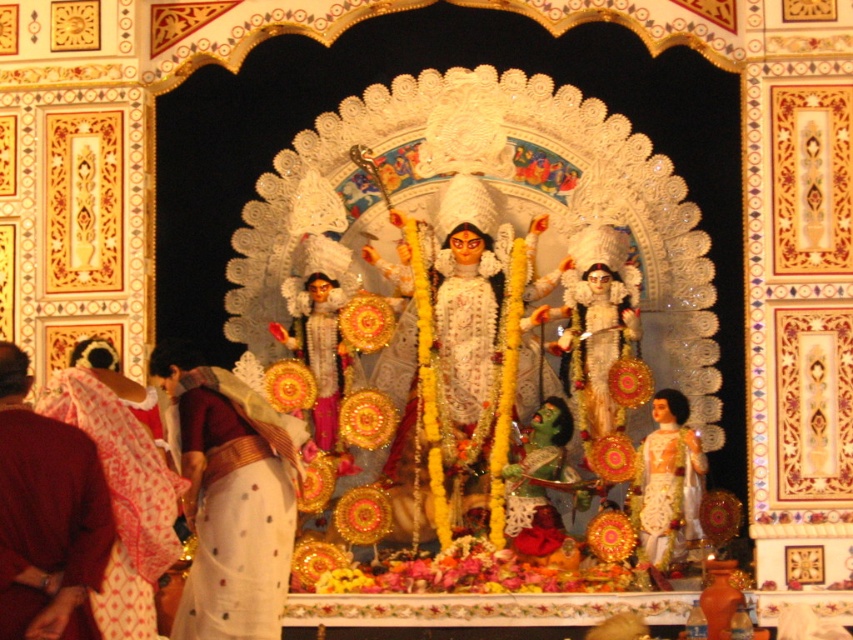
Consider the image. Which of these two, white silk saree at center or maroon silk robe at lower left, stands shorter?

Standing shorter between the two is maroon silk robe at lower left.

Who is higher up, white silk saree at center or maroon silk robe at lower left?

maroon silk robe at lower left is higher up.

Is point (201, 444) positioned before point (15, 461)?

No, it is behind (15, 461).

At what (x,y) coordinates should I click in order to perform the action: click on white silk saree at center. Please return your answer as a coordinate pair (x, y). Image resolution: width=853 pixels, height=640 pixels. Looking at the image, I should click on (234, 504).

Does maroon silk robe at lower left appear on the left side of white glossy statue at center?

Correct, you'll find maroon silk robe at lower left to the left of white glossy statue at center.

Between maroon silk robe at lower left and white glossy statue at center, which one appears on the right side from the viewer's perspective?

white glossy statue at center

Where is `maroon silk robe at lower left`? This screenshot has width=853, height=640. maroon silk robe at lower left is located at coordinates (49, 525).

Between maroon silk robe at lower left and white textured cloth at lower left, which one appears on the right side from the viewer's perspective?

maroon silk robe at lower left

Can you confirm if maroon silk robe at lower left is shorter than white textured cloth at lower left?

Correct, maroon silk robe at lower left is not as tall as white textured cloth at lower left.

What do you see at coordinates (49, 525) in the screenshot? This screenshot has height=640, width=853. I see `maroon silk robe at lower left` at bounding box center [49, 525].

This screenshot has height=640, width=853. I want to click on maroon silk robe at lower left, so click(49, 525).